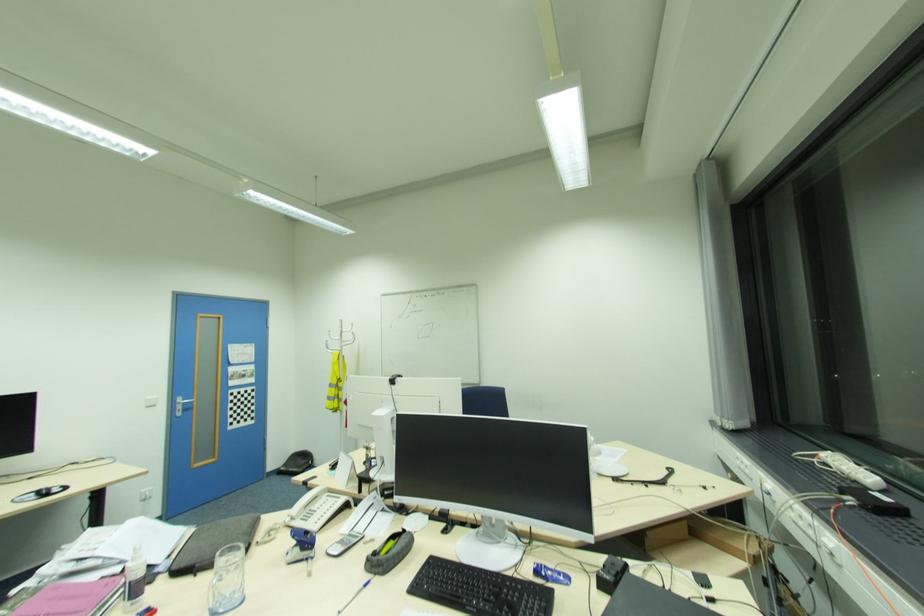
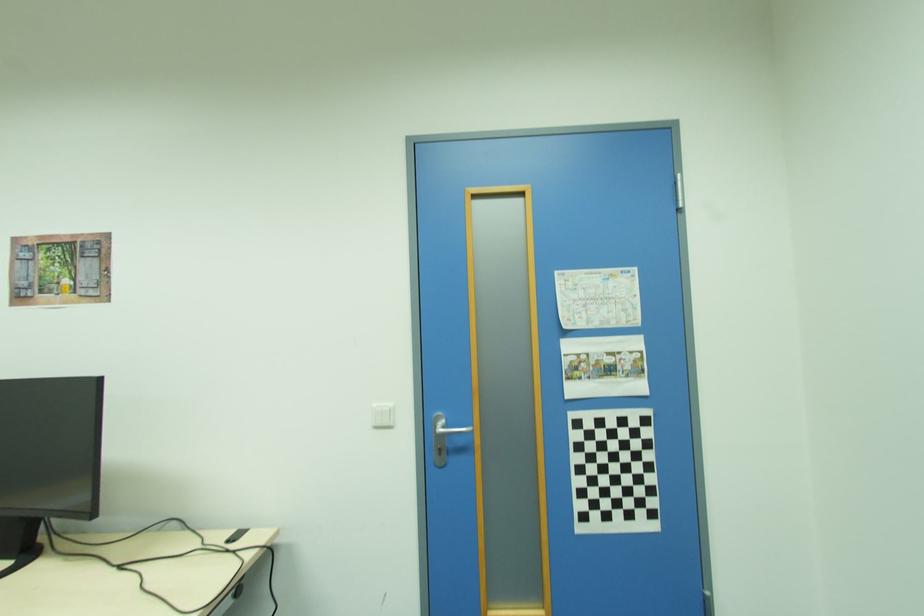
In the second image, find the point that corresponds to the point at 254,418 in the first image.

(655, 515)